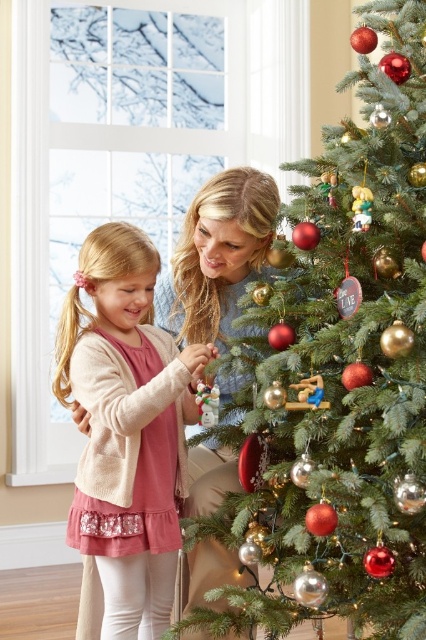
I want to click on shiny metallic ornaments at center, so click(x=339, y=371).

Does point (299, 488) lie behind point (143, 545)?

No.

Measure the distance between shiny metallic ornaments at center and camera.

shiny metallic ornaments at center is 4.57 feet from camera.

The image size is (426, 640). In order to click on shiny metallic ornaments at center in this screenshot , I will do `click(339, 371)`.